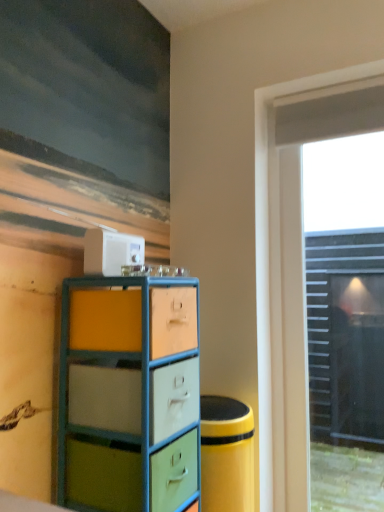
Question: Is transparent glass door at right wider than matte painted wood chest of drawers at center?

Choices:
 (A) no
 (B) yes

Answer: (A)

Question: Would you say matte painted wood chest of drawers at center is part of transparent glass door at right's contents?

Choices:
 (A) no
 (B) yes

Answer: (A)

Question: From a real-world perspective, is transparent glass door at right located higher than matte painted wood chest of drawers at center?

Choices:
 (A) no
 (B) yes

Answer: (B)

Question: Is transparent glass door at right positioned with its back to matte painted wood chest of drawers at center?

Choices:
 (A) no
 (B) yes

Answer: (A)

Question: Is transparent glass door at right to the right of matte painted wood chest of drawers at center from the viewer's perspective?

Choices:
 (A) no
 (B) yes

Answer: (B)

Question: From the image's perspective, is transparent glass door at right on matte painted wood chest of drawers at center?

Choices:
 (A) yes
 (B) no

Answer: (A)

Question: Is white plastic toaster at upper center far away from transparent glass door at right?

Choices:
 (A) no
 (B) yes

Answer: (A)

Question: Is white plastic toaster at upper center positioned with its back to transparent glass door at right?

Choices:
 (A) yes
 (B) no

Answer: (B)

Question: Is white plastic toaster at upper center wider than transparent glass door at right?

Choices:
 (A) no
 (B) yes

Answer: (A)

Question: From a real-world perspective, is white plastic toaster at upper center over transparent glass door at right?

Choices:
 (A) yes
 (B) no

Answer: (A)

Question: Is white plastic toaster at upper center aimed at transparent glass door at right?

Choices:
 (A) no
 (B) yes

Answer: (A)

Question: Is white plastic toaster at upper center closer to camera compared to transparent glass door at right?

Choices:
 (A) yes
 (B) no

Answer: (A)

Question: From a real-world perspective, does transparent glass door at right sit lower than white plastic toaster at upper center?

Choices:
 (A) yes
 (B) no

Answer: (A)